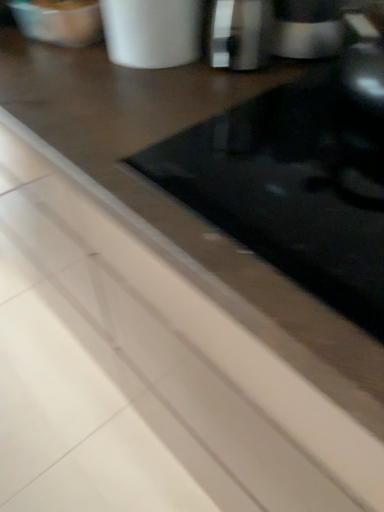
What do you see at coordinates (273, 31) in the screenshot? This screenshot has width=384, height=512. I see `sleek silver coffee machine at upper right` at bounding box center [273, 31].

The height and width of the screenshot is (512, 384). Find the location of `sleek silver coffee machine at upper right`. sleek silver coffee machine at upper right is located at coordinates (273, 31).

Image resolution: width=384 pixels, height=512 pixels. What are the coordinates of `metallic silver cup at upper center` in the screenshot? It's located at (152, 32).

Describe the element at coordinates (152, 32) in the screenshot. I see `metallic silver cup at upper center` at that location.

Where is `sleek silver coffee machine at upper right`? This screenshot has width=384, height=512. sleek silver coffee machine at upper right is located at coordinates (273, 31).

Between sleek silver coffee machine at upper right and metallic silver cup at upper center, which one appears on the left side from the viewer's perspective?

From the viewer's perspective, metallic silver cup at upper center appears more on the left side.

Considering the positions of objects sleek silver coffee machine at upper right and metallic silver cup at upper center in the image provided, who is behind, sleek silver coffee machine at upper right or metallic silver cup at upper center?

sleek silver coffee machine at upper right.

Is point (254, 56) positioned before point (173, 2)?

No, it is not.

Looking at this image, from the image's perspective, who appears lower, sleek silver coffee machine at upper right or metallic silver cup at upper center?

From the image's view, sleek silver coffee machine at upper right is below.

From a real-world perspective, is sleek silver coffee machine at upper right above or below metallic silver cup at upper center?

In terms of real-world spatial position, sleek silver coffee machine at upper right is below metallic silver cup at upper center.

Is sleek silver coffee machine at upper right wider than metallic silver cup at upper center?

No, sleek silver coffee machine at upper right is not wider than metallic silver cup at upper center.

Considering the relative sizes of sleek silver coffee machine at upper right and metallic silver cup at upper center in the image provided, is sleek silver coffee machine at upper right taller than metallic silver cup at upper center?

No, sleek silver coffee machine at upper right is not taller than metallic silver cup at upper center.

Does sleek silver coffee machine at upper right have a larger size compared to metallic silver cup at upper center?

No.

Is sleek silver coffee machine at upper right not inside metallic silver cup at upper center?

That's correct, sleek silver coffee machine at upper right is outside of metallic silver cup at upper center.

Can you see sleek silver coffee machine at upper right touching metallic silver cup at upper center?

No, sleek silver coffee machine at upper right is not next to metallic silver cup at upper center.

Is sleek silver coffee machine at upper right facing towards metallic silver cup at upper center?

No.

In order to click on coffee machine lying behind the metallic silver cup at upper center in this screenshot , I will do `click(273, 31)`.

Based on their positions, is metallic silver cup at upper center located to the left or right of sleek silver coffee machine at upper right?

From the image, it's evident that metallic silver cup at upper center is to the left of sleek silver coffee machine at upper right.

In the image, is metallic silver cup at upper center positioned in front of or behind sleek silver coffee machine at upper right?

Clearly, metallic silver cup at upper center is in front of sleek silver coffee machine at upper right.

Does point (135, 66) come in front of point (341, 22)?

No, (135, 66) is behind (341, 22).

From the image's perspective, which one is positioned lower, metallic silver cup at upper center or sleek silver coffee machine at upper right?

From the image's view, sleek silver coffee machine at upper right is below.

From a real-world perspective, who is located lower, metallic silver cup at upper center or sleek silver coffee machine at upper right?

sleek silver coffee machine at upper right is physically lower.

Looking at their sizes, would you say metallic silver cup at upper center is wider or thinner than sleek silver coffee machine at upper right?

Clearly, metallic silver cup at upper center has more width compared to sleek silver coffee machine at upper right.

Considering the sizes of objects metallic silver cup at upper center and sleek silver coffee machine at upper right in the image provided, who is shorter, metallic silver cup at upper center or sleek silver coffee machine at upper right?

sleek silver coffee machine at upper right.

Can you confirm if metallic silver cup at upper center is bigger than sleek silver coffee machine at upper right?

Yes.

Would you say sleek silver coffee machine at upper right is part of metallic silver cup at upper center's contents?

No, sleek silver coffee machine at upper right is not a part of metallic silver cup at upper center.

From the picture: Does metallic silver cup at upper center touch sleek silver coffee machine at upper right?

No, metallic silver cup at upper center is not next to sleek silver coffee machine at upper right.

Is metallic silver cup at upper center facing towards sleek silver coffee machine at upper right?

No, metallic silver cup at upper center does not turn towards sleek silver coffee machine at upper right.

Can you tell me how much metallic silver cup at upper center and sleek silver coffee machine at upper right differ in facing direction?

0.00147 degrees.

Based on the photo, measure the distance from metallic silver cup at upper center to sleek silver coffee machine at upper right.

metallic silver cup at upper center and sleek silver coffee machine at upper right are 4.35 inches apart from each other.

At what (x,y) coordinates should I click in order to perform the action: click on coffee machine behind the metallic silver cup at upper center. Please return your answer as a coordinate pair (x, y). Looking at the image, I should click on (273, 31).

The height and width of the screenshot is (512, 384). What are the coordinates of `coffee machine on the right of the metallic silver cup at upper center` in the screenshot? It's located at (273, 31).

At what (x,y) coordinates should I click in order to perform the action: click on appliance above the sleek silver coffee machine at upper right (from a real-world perspective). Please return your answer as a coordinate pair (x, y). This screenshot has height=512, width=384. Looking at the image, I should click on (152, 32).